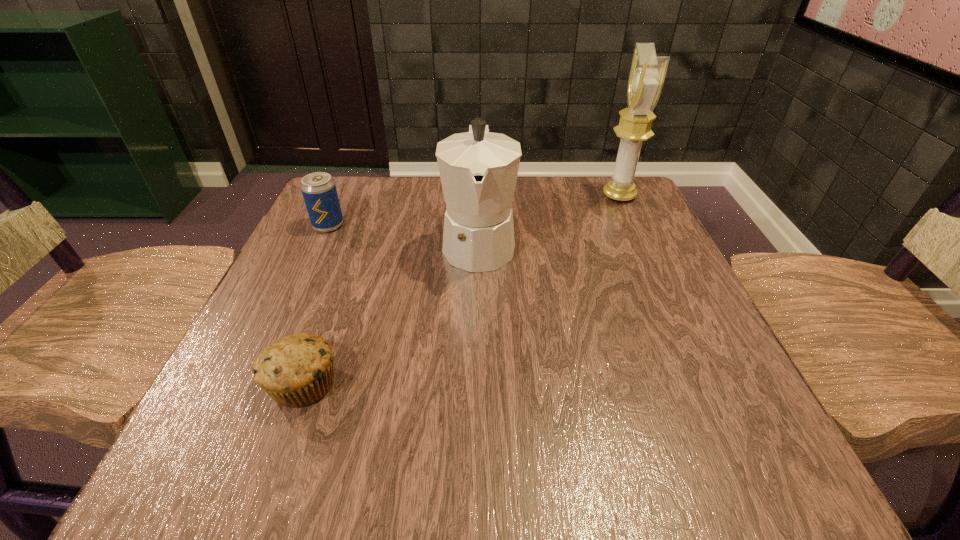
You are a GUI agent. You are given a task and a screenshot of the screen. Output one action in this format:
    pyautogui.click(x=<x>, y=<y>)
    Task: Click on the free area in between the second object from right to left and the farthest object
    This screenshot has height=540, width=960.
    Given the screenshot: What is the action you would take?
    pyautogui.click(x=549, y=219)

At what (x,y) coordinates should I click in order to perform the action: click on free area in between the beer can and the coffeepot. Please return your answer as a coordinate pair (x, y). This screenshot has width=960, height=540. Looking at the image, I should click on (403, 234).

Identify the location of object that is the second closest to the tallest object. The width and height of the screenshot is (960, 540). (319, 191).

Identify which object is located as the nearest to the third object from left to right. Please provide its 2D coordinates. Your answer should be formatted as a tuple, i.e. [(x, y)], where the tuple contains the x and y coordinates of a point satisfying the conditions above.

[(297, 370)]

At what (x,y) coordinates should I click in order to perform the action: click on free location that satisfies the following two spatial constraints: 1. on the front-facing side of the award; 2. on the front side of the beer can. Please return your answer as a coordinate pair (x, y). Looking at the image, I should click on 633,226.